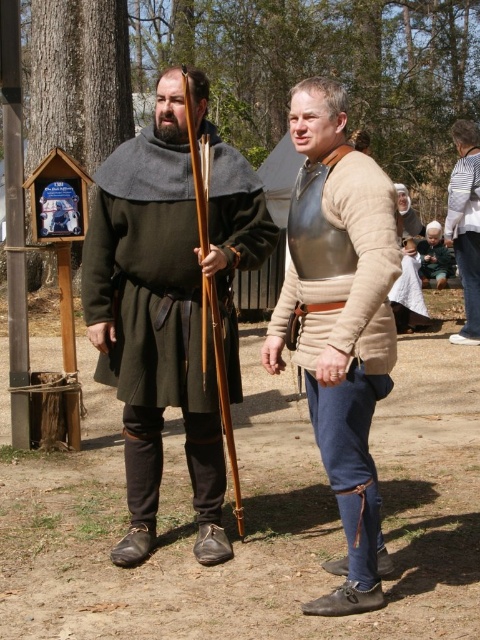
You are an event organizer and need to place a small banner near the green woolen tunic at center. Where should you place it?

The green woolen tunic at center is located at point (168, 304), so place the banner near that coordinate.

You are organizing a historical reenactment event and need to ensure that the green woolen tunic at center and the striped cotton sweater at upper right fit into display cases. The case for the larger garment can only accommodate items up to 1.2 meters in length. Which garment should be placed in the larger case?

The green woolen tunic at center should be placed in the larger case since it has a larger size compared to the striped cotton sweater at upper right, and the case can accommodate items up to 1.2 meters in length.

You are organizing a costume fitting session and need to determine if the green woolen tunic at center can be worn over the striped cotton sweater at upper right. Based on their widths, can the tunic accommodate the sweater underneath?

The green woolen tunic at center might be wider than striped cotton sweater at upper right, so it is possible that the tunic can be worn over the sweater without fitting issues.